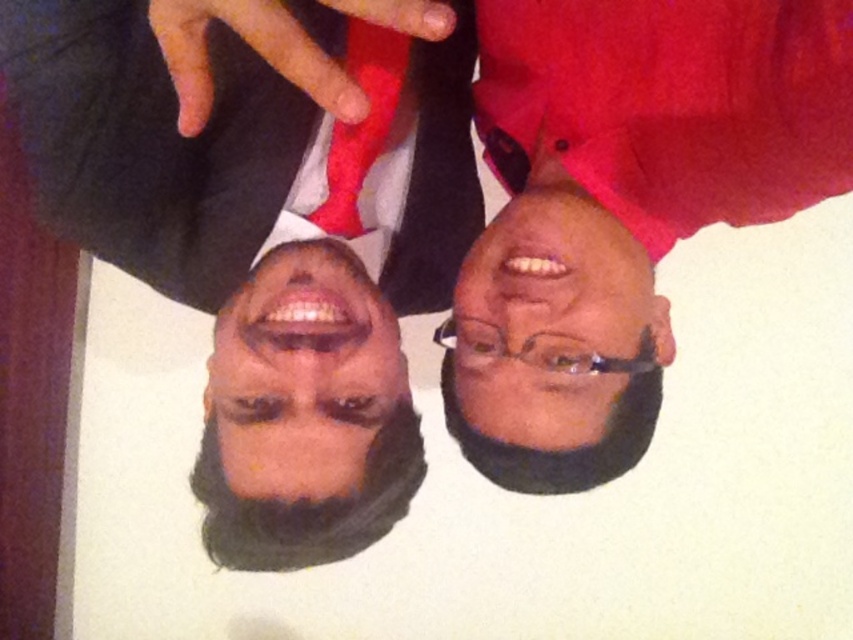
Question: Does matte black glasses at center have a larger size compared to matte red fabric at upper center?

Choices:
 (A) yes
 (B) no

Answer: (A)

Question: Which of the following is the farthest from the observer?

Choices:
 (A) (354, 132)
 (B) (264, 381)
 (C) (625, 266)

Answer: (A)

Question: Is matte black glasses at center positioned behind smooth skin face at center?

Choices:
 (A) yes
 (B) no

Answer: (A)

Question: Which point is farther to the camera?

Choices:
 (A) (550, 202)
 (B) (344, 88)

Answer: (A)

Question: Which of the following is the farthest from the observer?

Choices:
 (A) (248, 333)
 (B) (328, 211)
 (C) (521, 260)
 (D) (412, 0)

Answer: (B)

Question: Is matte black glasses at center further to camera compared to smooth skin face at center?

Choices:
 (A) no
 (B) yes

Answer: (B)